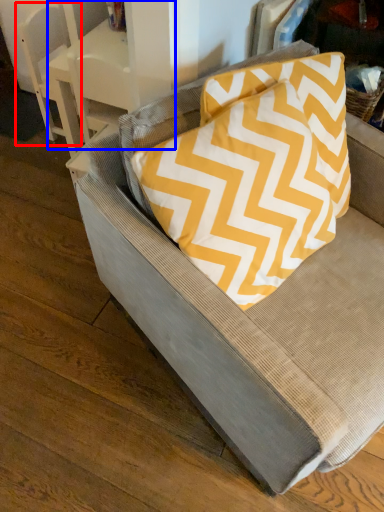
Question: Among these objects, which one is nearest to the camera, armchair (highlighted by a red box) or table (highlighted by a blue box)?

Choices:
 (A) armchair
 (B) table

Answer: (B)